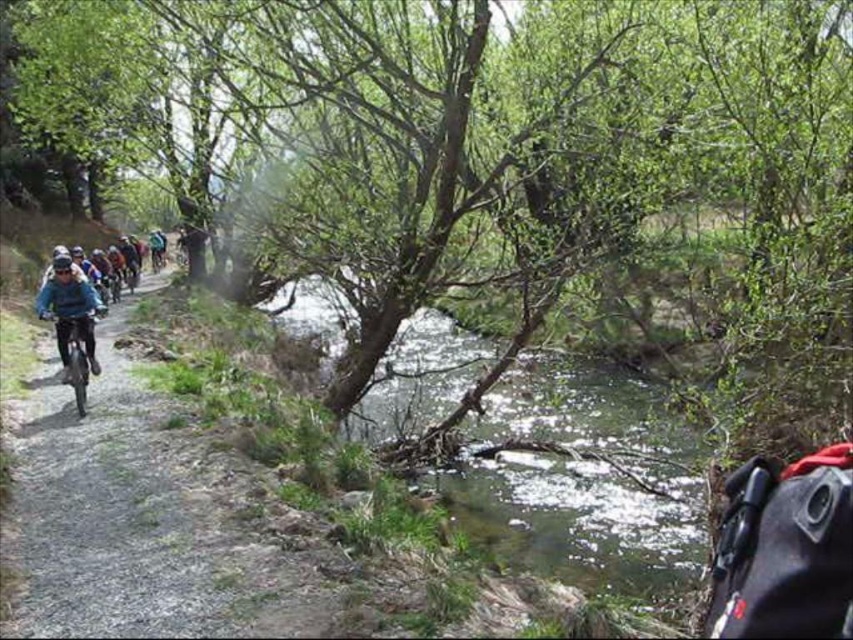
Question: Which object appears farthest from the camera in this image?

Choices:
 (A) shiny blue frame at left
 (B) green leafy creek at center
 (C) gravel path at left

Answer: (A)

Question: Does green leafy tree at upper center appear over green leafy creek at center?

Choices:
 (A) yes
 (B) no

Answer: (A)

Question: Which point appears farthest from the camera in this image?

Choices:
 (A) (260, 529)
 (B) (24, 84)

Answer: (B)

Question: Observing the image, what is the correct spatial positioning of gravel path at left in reference to green leafy creek at center?

Choices:
 (A) left
 (B) right

Answer: (A)

Question: Does gravel path at left come behind shiny blue frame at left?

Choices:
 (A) no
 (B) yes

Answer: (A)

Question: Estimate the real-world distances between objects in this image. Which object is closer to the gravel path at left?

Choices:
 (A) green leafy tree at upper center
 (B) shiny blue frame at left

Answer: (B)